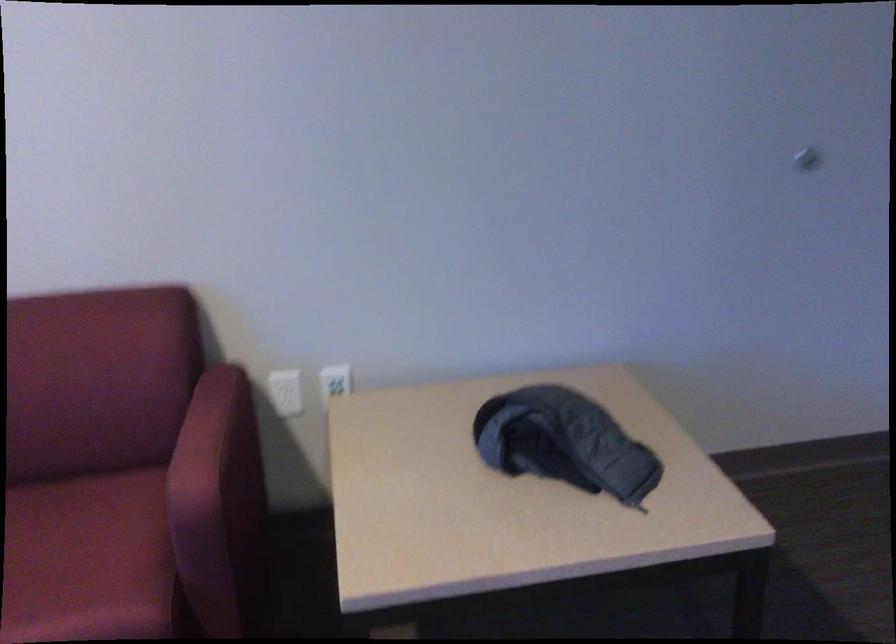
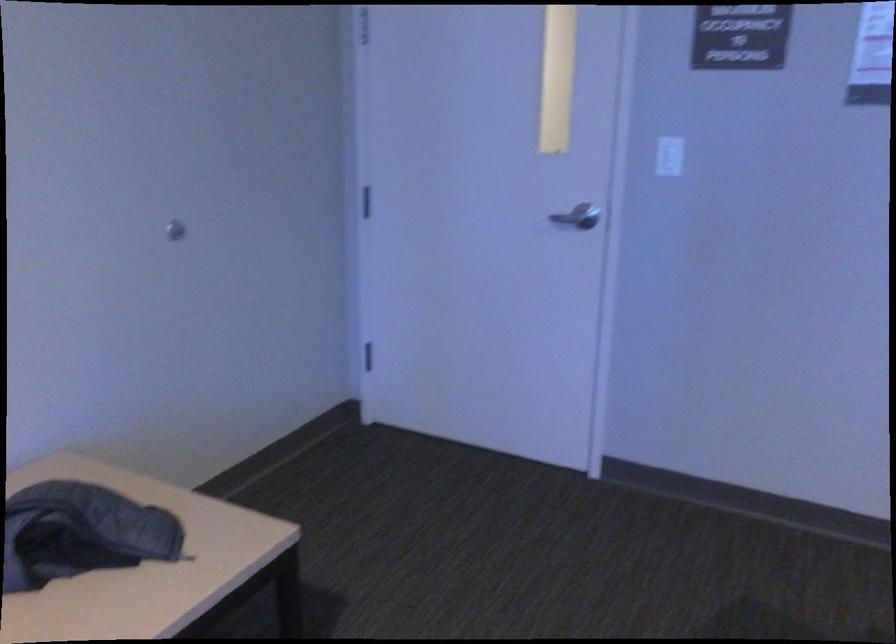
Question: How did the camera likely rotate?

Choices:
 (A) Left
 (B) Right
 (C) Up
 (D) Down

Answer: (B)